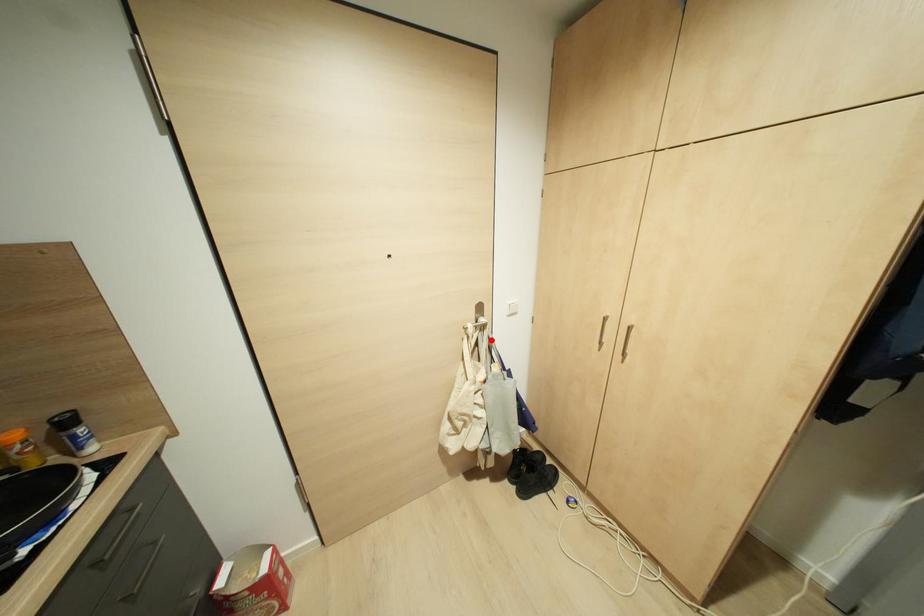
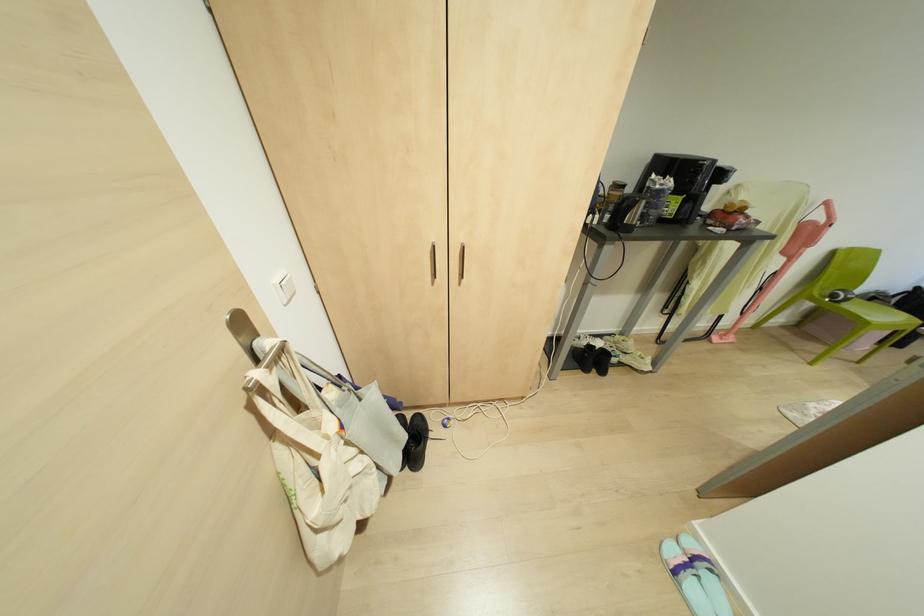
Question: I am providing you with two images of the same scene from different viewpoints. Image1 has a red point marked. In image2, the corresponding 3D location appears at what relative position? Reply with the corresponding letter.

Choices:
 (A) Closer
 (B) Farther

Answer: (A)